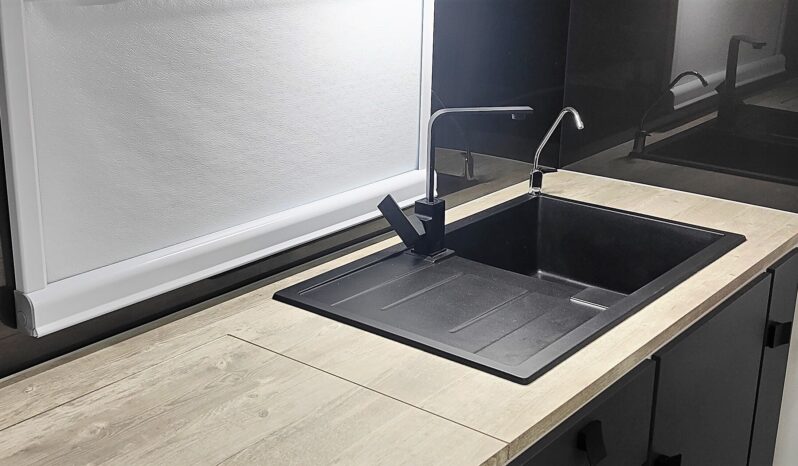
Locate an element on the screen. This screenshot has width=798, height=466. empty wooden counter is located at coordinates (270, 406).